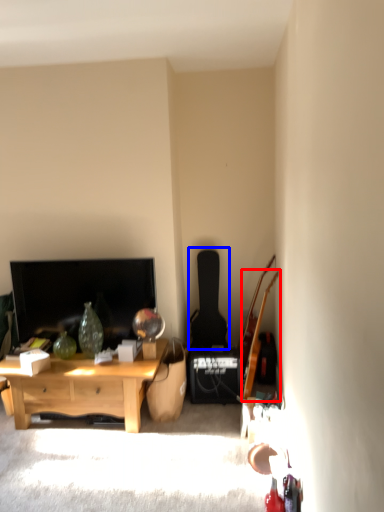
Question: Among these objects, which one is nearest to the camera, guitar (highlighted by a red box) or guitar (highlighted by a blue box)?

Choices:
 (A) guitar
 (B) guitar

Answer: (A)